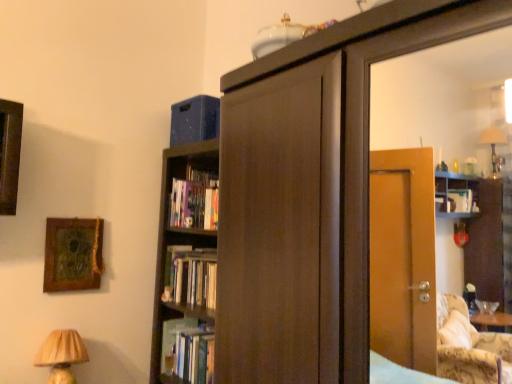
Question: From the image's perspective, is beige pleated lampshade at lower left located above or below hardcover book at center, acting as the 2th book starting from the bottom?

Choices:
 (A) above
 (B) below

Answer: (B)

Question: Does point (53, 369) appear closer or farther from the camera than point (182, 266)?

Choices:
 (A) closer
 (B) farther

Answer: (A)

Question: Which is farther from the beige pleated lampshade at lower left?

Choices:
 (A) hardcover book at center, which is the 1th book in top-to-bottom order
 (B) hardcover book at center, which appears as the 1th book when ordered from the bottom
 (C) wooden textured picture frame at upper left

Answer: (A)

Question: Estimate the real-world distances between objects in this image. Which object is closer to the hardcover book at center, acting as the 2th book starting from the bottom?

Choices:
 (A) wooden textured picture frame at upper left
 (B) hardcover book at center, the second book from the top
 (C) beige pleated lampshade at lower left

Answer: (B)